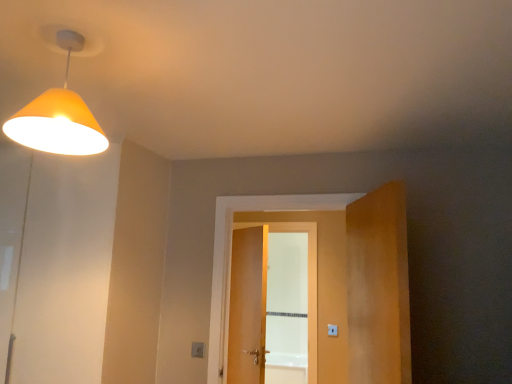
Question: Is orange matte lampshade at upper left at the back of wooden door at center?

Choices:
 (A) yes
 (B) no

Answer: (B)

Question: Is wooden door at center shorter than orange matte lampshade at upper left?

Choices:
 (A) no
 (B) yes

Answer: (A)

Question: From the image's perspective, is wooden door at center above orange matte lampshade at upper left?

Choices:
 (A) no
 (B) yes

Answer: (A)

Question: Is wooden door at center next to orange matte lampshade at upper left?

Choices:
 (A) yes
 (B) no

Answer: (B)

Question: Does wooden door at center come behind orange matte lampshade at upper left?

Choices:
 (A) no
 (B) yes

Answer: (B)

Question: In the image, is wooden door at center positioned in front of or behind white plastic light switch at lower center?

Choices:
 (A) behind
 (B) front

Answer: (B)

Question: Considering the positions of wooden door at center and white plastic light switch at lower center in the image, is wooden door at center taller or shorter than white plastic light switch at lower center?

Choices:
 (A) short
 (B) tall

Answer: (B)

Question: In terms of width, does wooden door at center look wider or thinner when compared to white plastic light switch at lower center?

Choices:
 (A) thin
 (B) wide

Answer: (B)

Question: Considering the relative positions of wooden door at center and white plastic light switch at lower center in the image provided, is wooden door at center to the left or to the right of white plastic light switch at lower center?

Choices:
 (A) right
 (B) left

Answer: (A)

Question: Looking at the image, does wooden door at center seem bigger or smaller compared to orange matte lampshade at upper left?

Choices:
 (A) big
 (B) small

Answer: (A)

Question: From a real-world perspective, is wooden door at center physically located above or below orange matte lampshade at upper left?

Choices:
 (A) above
 (B) below

Answer: (B)

Question: Is point (268, 198) positioned closer to the camera than point (94, 135)?

Choices:
 (A) closer
 (B) farther

Answer: (B)

Question: From their relative heights in the image, would you say wooden door at center is taller or shorter than orange matte lampshade at upper left?

Choices:
 (A) short
 (B) tall

Answer: (B)

Question: Is orange matte lampshade at upper left in front of or behind wooden door at center in the image?

Choices:
 (A) front
 (B) behind

Answer: (A)

Question: In the image, is orange matte lampshade at upper left on the left side or the right side of wooden door at center?

Choices:
 (A) right
 (B) left

Answer: (B)